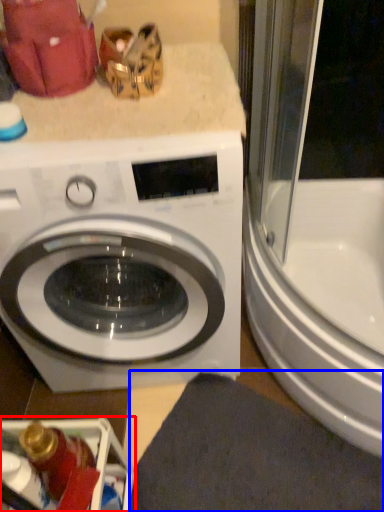
Question: Which of the following is the closest to the observer, dish washer (highlighted by a red box) or bath mat (highlighted by a blue box)?

Choices:
 (A) dish washer
 (B) bath mat

Answer: (A)